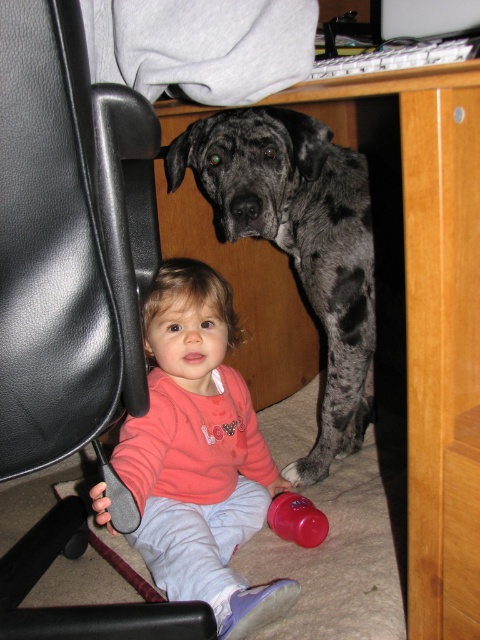
Does pink fleece sweater at lower left have a smaller size compared to rubberized pink cup at lower center?

Incorrect, pink fleece sweater at lower left is not smaller in size than rubberized pink cup at lower center.

Where is `pink fleece sweater at lower left`? The width and height of the screenshot is (480, 640). pink fleece sweater at lower left is located at coordinates (199, 454).

Which is in front, point (176, 563) or point (290, 532)?

Point (176, 563) is in front.

The image size is (480, 640). In order to click on pink fleece sweater at lower left in this screenshot , I will do `click(199, 454)`.

Can you confirm if black leather swivel chair at left is taller than rubberized pink cup at lower center?

Correct, black leather swivel chair at left is much taller as rubberized pink cup at lower center.

Which is behind, point (99, 240) or point (319, 541)?

The point (319, 541) is more distant.

Which is in front, point (11, 624) or point (308, 516)?

Positioned in front is point (11, 624).

At what (x,y) coordinates should I click in order to perform the action: click on black leather swivel chair at left. Please return your answer as a coordinate pair (x, y). The height and width of the screenshot is (640, 480). Looking at the image, I should click on (63, 240).

Can you confirm if wooden at center is positioned to the right of pink fleece sweater at lower left?

Correct, you'll find wooden at center to the right of pink fleece sweater at lower left.

Which is more to the left, wooden at center or pink fleece sweater at lower left?

pink fleece sweater at lower left is more to the left.

Is point (475, 480) closer to camera compared to point (224, 400)?

Yes, point (475, 480) is closer to viewer.

Where is `wooden at center`? The image size is (480, 640). wooden at center is located at coordinates (424, 307).